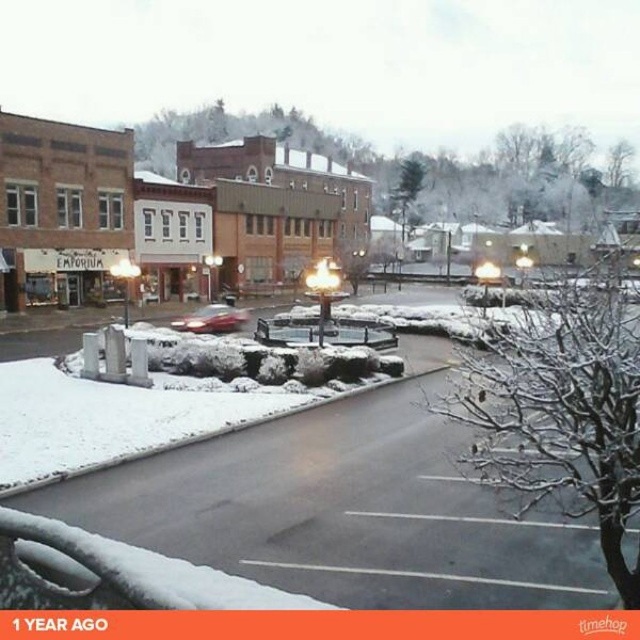
Does brick building at center have a lesser height compared to shiny red car at center?

No, brick building at center is not shorter than shiny red car at center.

I want to click on brick building at center, so click(x=164, y=214).

Can you confirm if white fluffy snow at center is shorter than shiny red car at center?

Indeed, white fluffy snow at center has a lesser height compared to shiny red car at center.

Is point (84, 404) in front of point (204, 316)?

Yes, it is in front of point (204, 316).

Where is `white fluffy snow at center`? white fluffy snow at center is located at coordinates (108, 419).

Measure the distance between brick building at center and camera.

The distance of brick building at center from camera is 34.83 meters.

Between brick building at center and white fluffy snow at center, which one appears on the left side from the viewer's perspective?

Positioned to the left is brick building at center.

Is point (192, 163) more distant than point (125, 428)?

Yes, point (192, 163) is farther from viewer.

Locate an element on the screen. brick building at center is located at coordinates (164, 214).